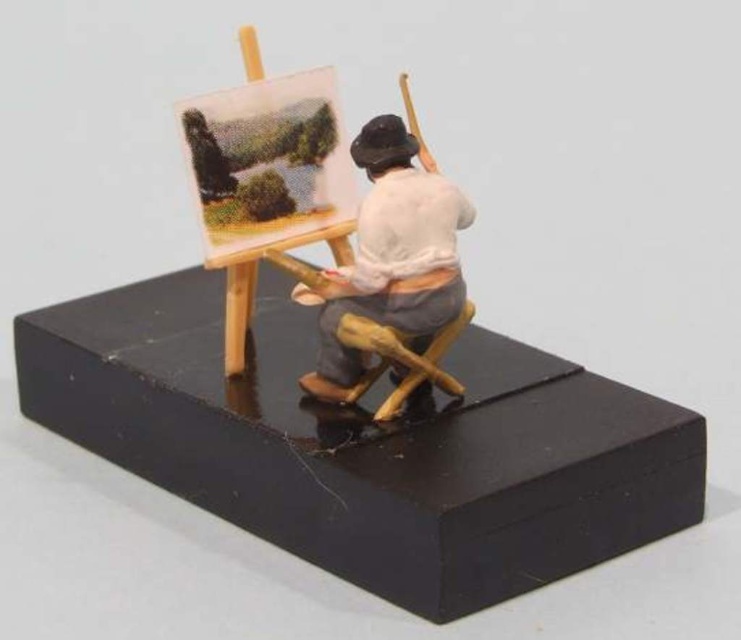
Question: Which object appears closest to the camera in this image?

Choices:
 (A) wooden easel at center
 (B) wooden figure at center

Answer: (B)

Question: Can you confirm if wooden easel at center is positioned above wooden figure at center?

Choices:
 (A) no
 (B) yes

Answer: (B)

Question: Which object is farther from the camera taking this photo?

Choices:
 (A) wooden easel at center
 (B) wooden figure at center

Answer: (A)

Question: Which point appears farthest from the camera in this image?

Choices:
 (A) (451, 205)
 (B) (199, 193)

Answer: (B)

Question: Is wooden easel at center positioned in front of wooden figure at center?

Choices:
 (A) no
 (B) yes

Answer: (A)

Question: Is wooden easel at center thinner than wooden figure at center?

Choices:
 (A) no
 (B) yes

Answer: (B)